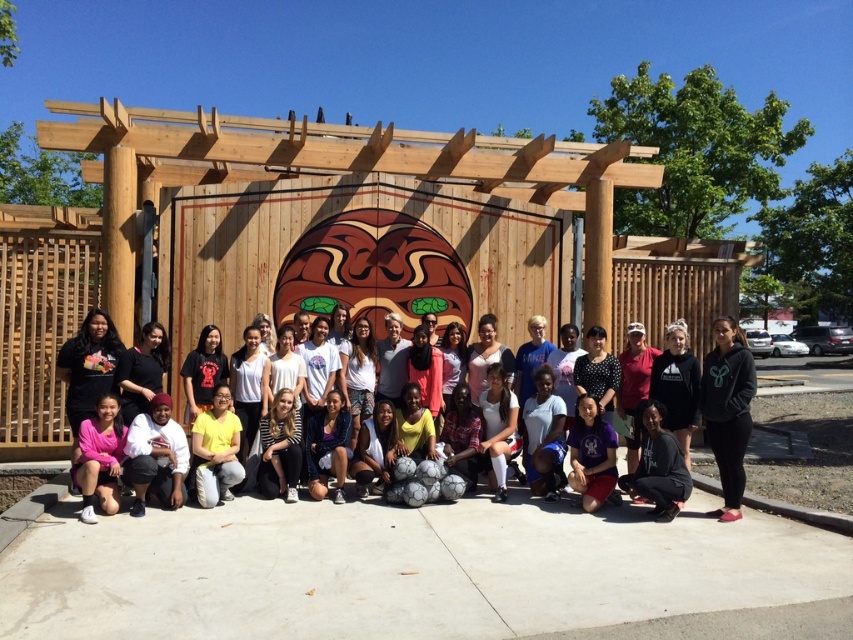
Question: Which object is farther from the camera taking this photo?

Choices:
 (A) white matte shirt at center
 (B) black hoodie at lower right

Answer: (A)

Question: Can you confirm if white matte shirt at center is positioned below yellow matte shirt at center?

Choices:
 (A) no
 (B) yes

Answer: (A)

Question: Estimate the real-world distances between objects in this image. Which object is farther from the black hoodie at lower right?

Choices:
 (A) matte black hoodie at center
 (B) yellow matte shirt at center

Answer: (B)

Question: Among these objects, which one is nearest to the camera?

Choices:
 (A) yellow matte shirt at center
 (B) white matte shirt at center

Answer: (B)

Question: Is black hoodie at lower right bigger than yellow matte shirt at center?

Choices:
 (A) no
 (B) yes

Answer: (B)

Question: Is white matte shirt at center below yellow matte shirt at center?

Choices:
 (A) yes
 (B) no

Answer: (B)